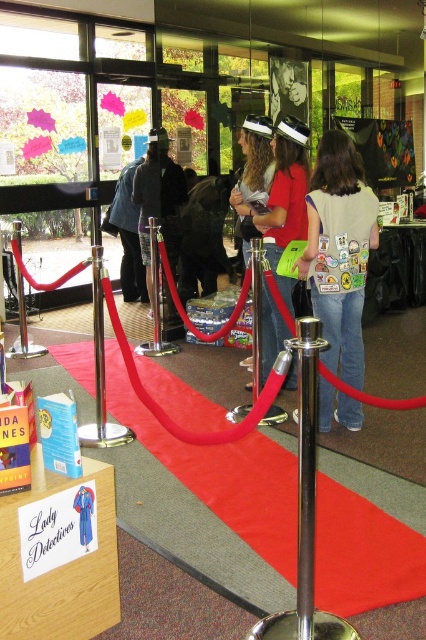
Is point (276, 132) positioned behind point (143, 230)?

No, (276, 132) is in front of (143, 230).

Does red shirt at center appear under dark blue fabric hat at center?

Yes.

Which is behind, point (293, 132) or point (147, 275)?

Point (147, 275)

Locate an element on the screen. The width and height of the screenshot is (426, 640). red shirt at center is located at coordinates (282, 198).

Is red shirt at center positioned in front of metallic silver pole at center?

No, it is behind metallic silver pole at center.

How far apart are red shirt at center and metallic silver pole at center?

2.08 meters

Locate an element on the screen. This screenshot has width=426, height=640. red shirt at center is located at coordinates (282, 198).

Is white fabric shirt at center to the left of metallic silver pole at center from the viewer's perspective?

Incorrect, white fabric shirt at center is not on the left side of metallic silver pole at center.

Can you confirm if white fabric shirt at center is positioned below metallic silver pole at center?

Actually, white fabric shirt at center is above metallic silver pole at center.

Image resolution: width=426 pixels, height=640 pixels. I want to click on white fabric shirt at center, so click(x=339, y=252).